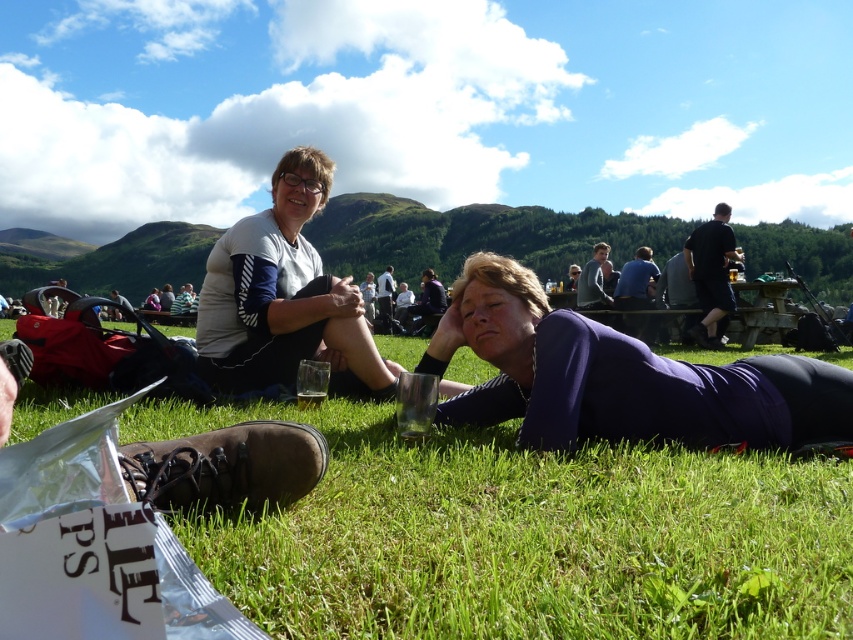
Question: Does purple matte shirt at lower center have a larger size compared to matte black backpack at left?

Choices:
 (A) no
 (B) yes

Answer: (A)

Question: Which object is positioned farthest from the matte black backpack at left?

Choices:
 (A) black smooth shirt at upper right
 (B) light gray fabric jacket at center
 (C) white fabric shirt at upper left

Answer: (A)

Question: Can you confirm if white fabric shirt at upper left is smaller than matte black backpack at left?

Choices:
 (A) yes
 (B) no

Answer: (A)

Question: Which of the following is the closest to the observer?

Choices:
 (A) tap(717, 314)
 (B) tap(605, 257)
 (C) tap(112, 316)
 (D) tap(440, 410)

Answer: (D)

Question: Which point is closer to the camera?

Choices:
 (A) (113, 317)
 (B) (697, 396)

Answer: (B)

Question: Does black smooth shirt at upper right lie in front of matte black backpack at left?

Choices:
 (A) no
 (B) yes

Answer: (A)